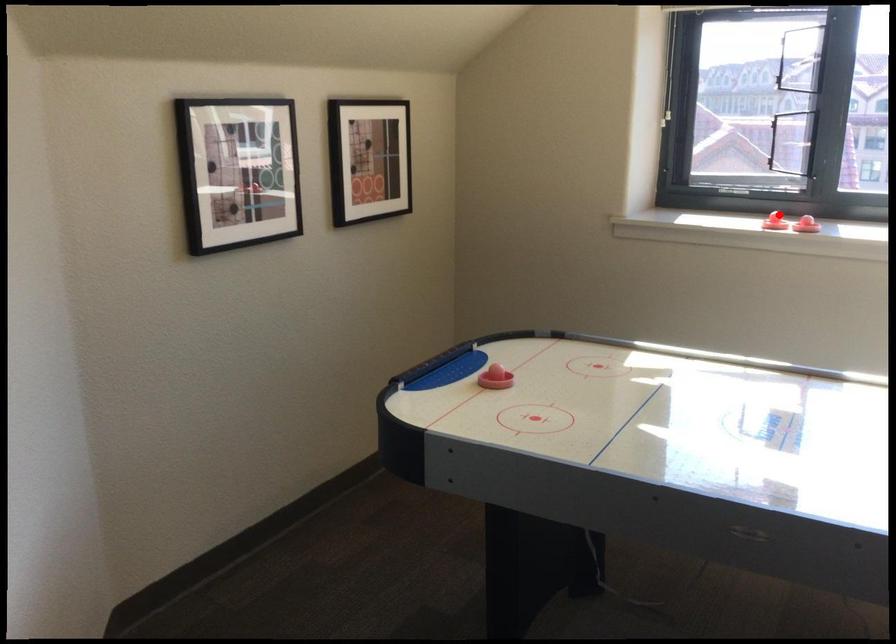
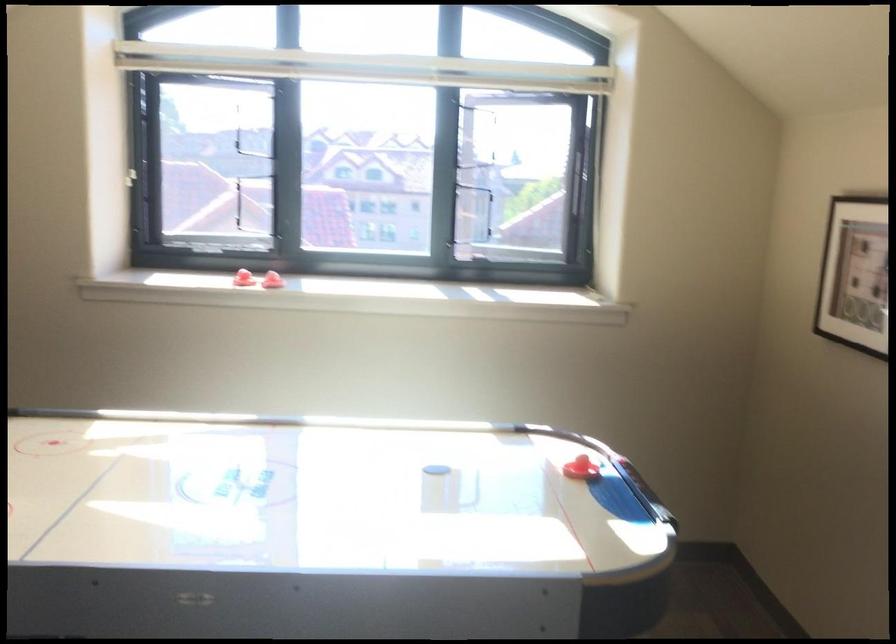
The point at the highlighted location is marked in the first image. Where is the corresponding point in the second image?

(244, 279)